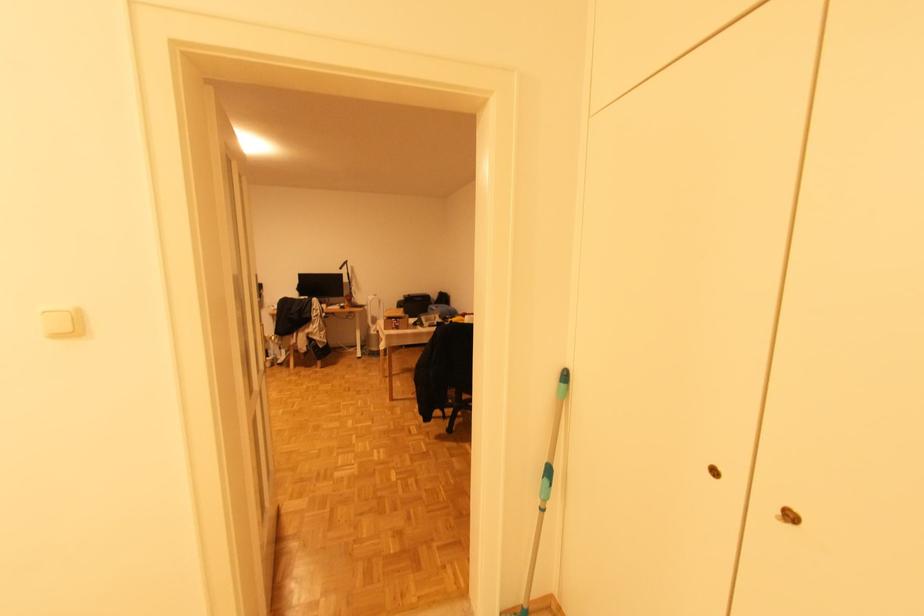
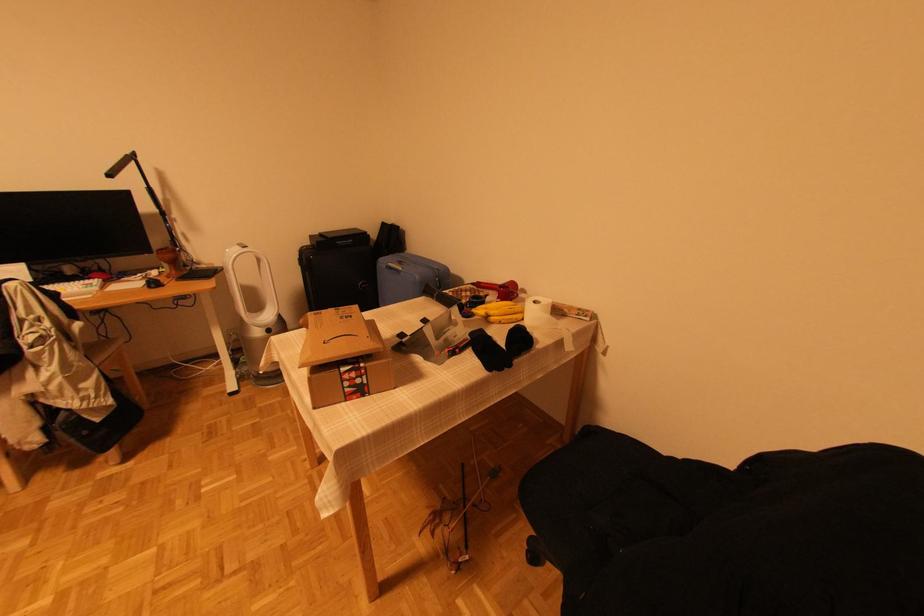
In the second image, find the point that corresponds to point 329,329 in the first image.

(114, 351)